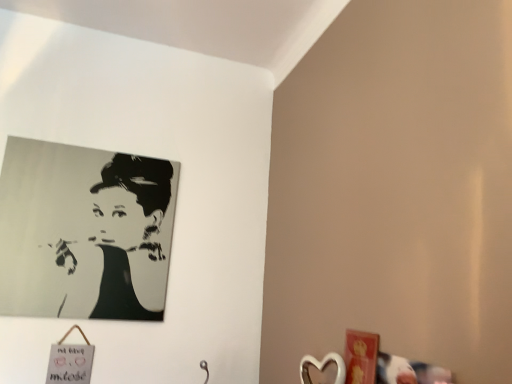
At what (x,y) coordinates should I click in order to perform the action: click on metallic silver heart at lower right. Please return your answer as a coordinate pair (x, y). The width and height of the screenshot is (512, 384). Looking at the image, I should click on (322, 367).

This screenshot has width=512, height=384. Describe the element at coordinates (322, 367) in the screenshot. I see `metallic silver heart at lower right` at that location.

Image resolution: width=512 pixels, height=384 pixels. Find the location of `black matte portrait at upper left`. black matte portrait at upper left is located at coordinates (128, 229).

The image size is (512, 384). Describe the element at coordinates (128, 229) in the screenshot. I see `black matte portrait at upper left` at that location.

Find the location of a particular element. The height and width of the screenshot is (384, 512). metallic silver heart at lower right is located at coordinates (322, 367).

Which object is positioned more to the right, black matte portrait at upper left or metallic silver heart at lower right?

metallic silver heart at lower right is more to the right.

Between black matte portrait at upper left and metallic silver heart at lower right, which one is positioned in front?

metallic silver heart at lower right is in front.

Considering the positions of points (127, 225) and (308, 377), is point (127, 225) closer to camera compared to point (308, 377)?

No, it is not.

Consider the image. From the image's perspective, is black matte portrait at upper left located above or below metallic silver heart at lower right?

Clearly, from the image's perspective, black matte portrait at upper left is above metallic silver heart at lower right.

From a real-world perspective, is black matte portrait at upper left positioned above or below metallic silver heart at lower right?

black matte portrait at upper left is situated higher than metallic silver heart at lower right in the real world.

Considering the relative sizes of black matte portrait at upper left and metallic silver heart at lower right in the image provided, is black matte portrait at upper left wider than metallic silver heart at lower right?

No, black matte portrait at upper left is not wider than metallic silver heart at lower right.

Considering the relative sizes of black matte portrait at upper left and metallic silver heart at lower right in the image provided, is black matte portrait at upper left taller than metallic silver heart at lower right?

Correct, black matte portrait at upper left is much taller as metallic silver heart at lower right.

Based on the photo, who is bigger, black matte portrait at upper left or metallic silver heart at lower right?

black matte portrait at upper left.

Is metallic silver heart at lower right a part of black matte portrait at upper left?

That's incorrect, metallic silver heart at lower right is not inside black matte portrait at upper left.

In the scene shown: Does black matte portrait at upper left touch metallic silver heart at lower right?

No, black matte portrait at upper left is not beside metallic silver heart at lower right.

Is black matte portrait at upper left oriented towards metallic silver heart at lower right?

No, black matte portrait at upper left does not turn towards metallic silver heart at lower right.

How different are the orientations of black matte portrait at upper left and metallic silver heart at lower right in degrees?

The angle between the facing direction of black matte portrait at upper left and the facing direction of metallic silver heart at lower right is 56.3 degrees.

Image resolution: width=512 pixels, height=384 pixels. What are the coordinates of `woman that is above the metallic silver heart at lower right (from a real-world perspective)` in the screenshot? It's located at (128, 229).

In the image, is metallic silver heart at lower right on the left side or the right side of black matte portrait at upper left?

Based on their positions, metallic silver heart at lower right is located to the right of black matte portrait at upper left.

Which object is closer to the camera taking this photo, metallic silver heart at lower right or black matte portrait at upper left?

Positioned in front is metallic silver heart at lower right.

Which is further, (336,358) or (158,229)?

The point (158,229) is farther from the camera.

From the image's perspective, between metallic silver heart at lower right and black matte portrait at upper left, who is located below?

From the image's view, metallic silver heart at lower right is below.

From a real-world perspective, is metallic silver heart at lower right located higher than black matte portrait at upper left?

No, from a real-world perspective, metallic silver heart at lower right is not over black matte portrait at upper left

Between metallic silver heart at lower right and black matte portrait at upper left, which one has larger width?

metallic silver heart at lower right is wider.

Who is shorter, metallic silver heart at lower right or black matte portrait at upper left?

metallic silver heart at lower right.

Which of these two, metallic silver heart at lower right or black matte portrait at upper left, is bigger?

black matte portrait at upper left.

Is metallic silver heart at lower right surrounding black matte portrait at upper left?

That's incorrect, black matte portrait at upper left is not inside metallic silver heart at lower right.

Is metallic silver heart at lower right beside black matte portrait at upper left?

metallic silver heart at lower right and black matte portrait at upper left are not in contact.

Is metallic silver heart at lower right looking in the opposite direction of black matte portrait at upper left?

metallic silver heart at lower right does not have its back to black matte portrait at upper left.

From the picture: What's the angular difference between metallic silver heart at lower right and black matte portrait at upper left's facing directions?

metallic silver heart at lower right and black matte portrait at upper left are facing 56.3 degrees away from each other.

At what (x,y) coordinates should I click in order to perform the action: click on woman on the left of the metallic silver heart at lower right. Please return your answer as a coordinate pair (x, y). Looking at the image, I should click on (128, 229).

Where is `picture frame below the black matte portrait at upper left (from a real-world perspective)`? picture frame below the black matte portrait at upper left (from a real-world perspective) is located at coordinates [322, 367].

The height and width of the screenshot is (384, 512). Find the location of `woman above the metallic silver heart at lower right (from a real-world perspective)`. woman above the metallic silver heart at lower right (from a real-world perspective) is located at coordinates (128, 229).